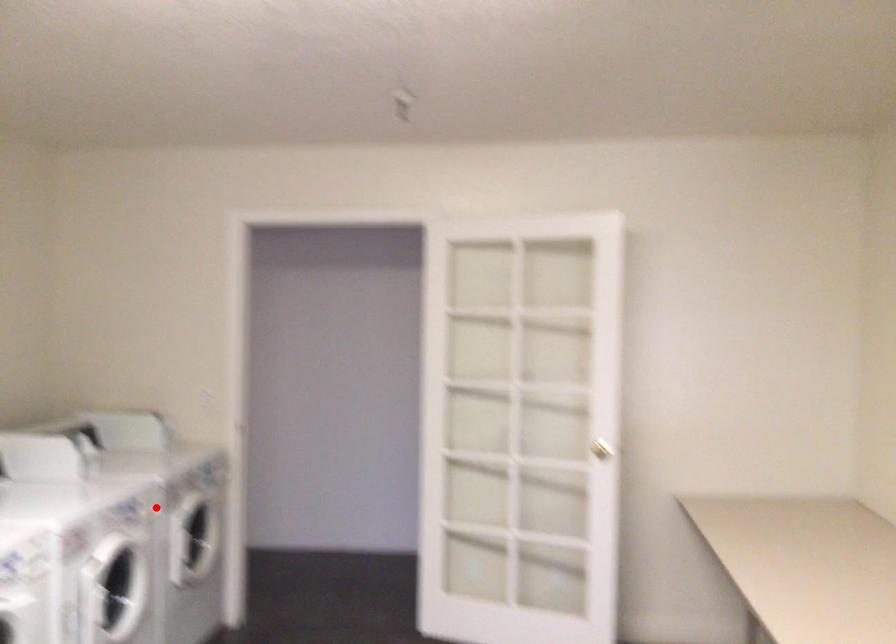
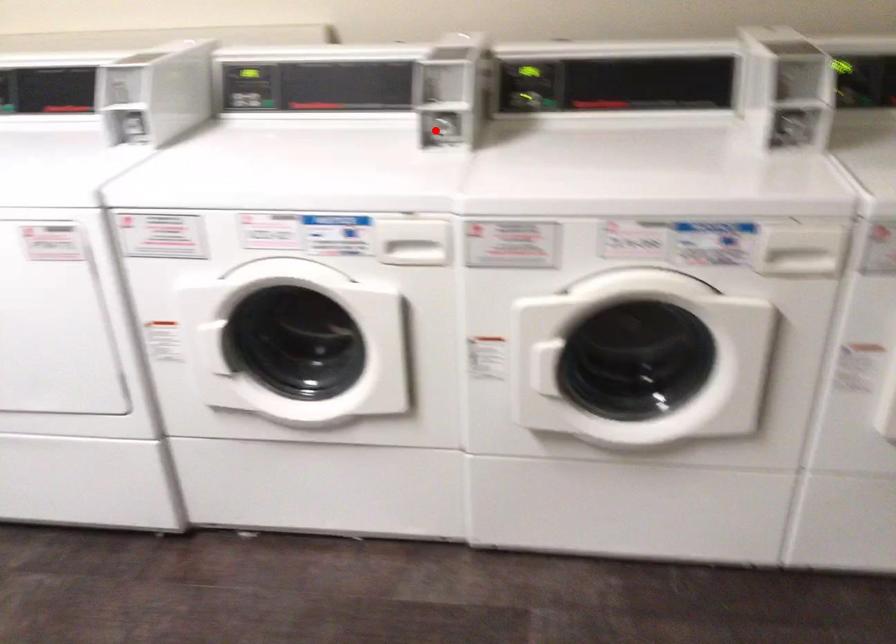
I am providing you with two images of the same scene from different viewpoints. A red point is marked on the first image and another point is marked on the second image. Are the points marked in image1 and image2 representing the same 3D position?

No